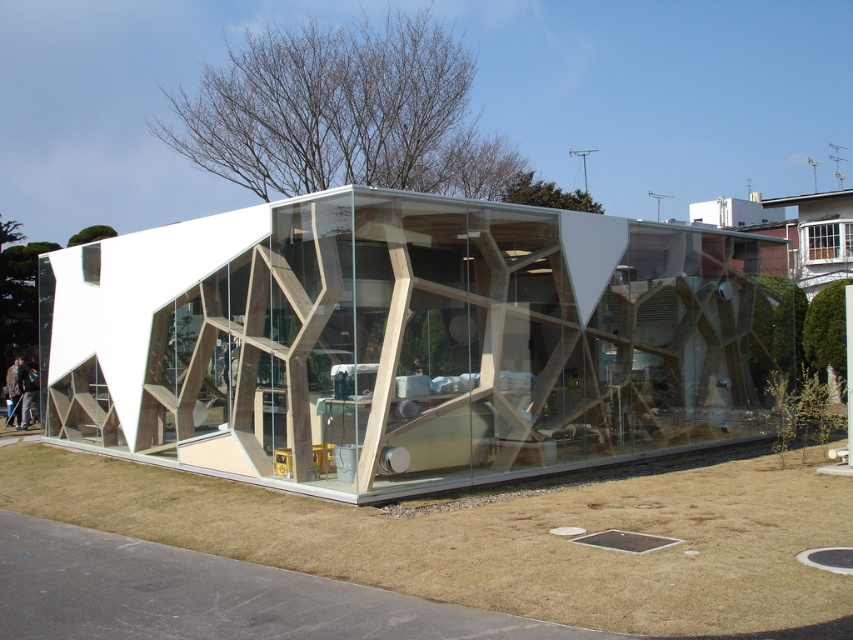
You are a delivery person who needs to place a large package in the building shown. The package is 1.2 meters wide. The transparent wood glass box at center and brown dry grass at lower center are in the way. Can you move the package between them?

The transparent wood glass box at center might be wider than brown dry grass at lower center, so it is uncertain if the package can fit. Check the actual width of the gap between them before moving the package.

You are a visitor approaching the transparent wood glass box at center and the brown dry grass at lower center in the image. Which object is closer to you as you walk towards them?

The transparent wood glass box at center is closer to you because the brown dry grass at lower center is behind it.

You are a visitor approaching the modern building and notice the transparent wood glass box at center and the brown dry grass at lower center. Which object would appear larger in height when viewed from the front entrance?

The transparent wood glass box at center is much taller than the brown dry grass at lower center, so it would appear larger in height when viewed from the front entrance.